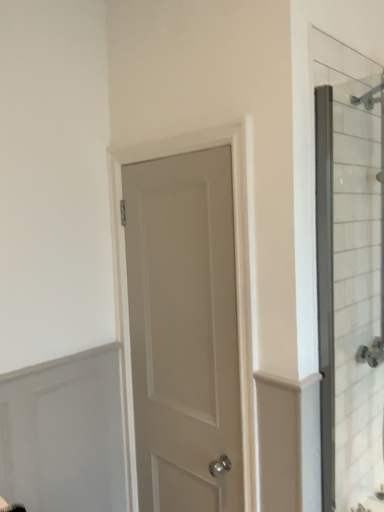
Locate an element on the screen. white matte door at center is located at coordinates (184, 330).

Describe the element at coordinates (184, 330) in the screenshot. The height and width of the screenshot is (512, 384). I see `white matte door at center` at that location.

At what (x,y) coordinates should I click in order to perform the action: click on clear glass shower door at right. Please return your answer as a coordinate pair (x, y). Looking at the image, I should click on tap(350, 271).

Describe the element at coordinates (350, 271) in the screenshot. I see `clear glass shower door at right` at that location.

The image size is (384, 512). Find the location of `white matte door at center`. white matte door at center is located at coordinates (184, 330).

Between white matte door at center and clear glass shower door at right, which one appears on the left side from the viewer's perspective?

white matte door at center is more to the left.

Is white matte door at center positioned behind clear glass shower door at right?

That is True.

Is point (188, 280) positioned after point (359, 365)?

Yes.

From the image's perspective, between white matte door at center and clear glass shower door at right, who is located below?

From the image's view, white matte door at center is below.

From a real-world perspective, which object stands above the other?

From a 3D spatial view, clear glass shower door at right is above.

Can you confirm if white matte door at center is thinner than clear glass shower door at right?

No, white matte door at center is not thinner than clear glass shower door at right.

Is white matte door at center taller or shorter than clear glass shower door at right?

Considering their sizes, white matte door at center has more height than clear glass shower door at right.

Between white matte door at center and clear glass shower door at right, which one has smaller size?

clear glass shower door at right.

Looking at this image, is white matte door at center spatially inside clear glass shower door at right, or outside of it?

white matte door at center cannot be found inside clear glass shower door at right.

Is white matte door at center directly adjacent to clear glass shower door at right?

white matte door at center and clear glass shower door at right are not in contact.

Is white matte door at center oriented towards clear glass shower door at right?

No.

Find the location of a particular element. door beneath the clear glass shower door at right (from a real-world perspective) is located at coordinates click(x=184, y=330).

Which is more to the right, clear glass shower door at right or white matte door at center?

clear glass shower door at right.

Is clear glass shower door at right positioned behind white matte door at center?

No, clear glass shower door at right is closer to the viewer.

Does point (352, 196) lie in front of point (144, 253)?

That is True.

From the image's perspective, would you say clear glass shower door at right is positioned over white matte door at center?

Indeed, from the image's perspective, clear glass shower door at right is shown above white matte door at center.

From a real-world perspective, which is physically above, clear glass shower door at right or white matte door at center?

clear glass shower door at right.

Which object is thinner, clear glass shower door at right or white matte door at center?

With smaller width is clear glass shower door at right.

Is clear glass shower door at right taller or shorter than white matte door at center?

In the image, clear glass shower door at right appears to be shorter than white matte door at center.

Who is bigger, clear glass shower door at right or white matte door at center?

Bigger between the two is white matte door at center.

In the scene shown: Would you say clear glass shower door at right contains white matte door at center?

No.

Is clear glass shower door at right placed right next to white matte door at center?

They are not placed beside each other.

Is clear glass shower door at right oriented away from white matte door at center?

No, clear glass shower door at right is not facing away from white matte door at center.

Where is `door on the left of clear glass shower door at right`? This screenshot has width=384, height=512. door on the left of clear glass shower door at right is located at coordinates (184, 330).

At what (x,y) coordinates should I click in order to perform the action: click on door to the left of clear glass shower door at right. Please return your answer as a coordinate pair (x, y). The image size is (384, 512). Looking at the image, I should click on point(184,330).

Locate an element on the screen. door that appears below the clear glass shower door at right (from the image's perspective) is located at coordinates tap(184, 330).